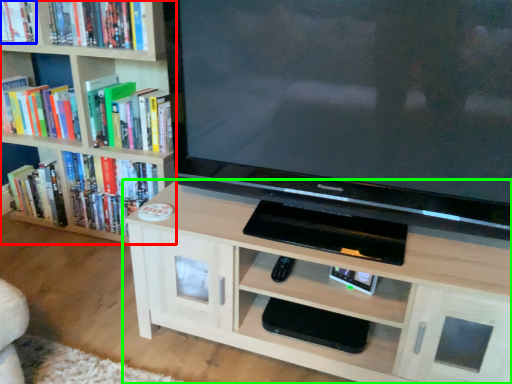
Question: Considering the real-world distances, which object is farthest from bookcase (highlighted by a red box)? book (highlighted by a blue box) or shelf (highlighted by a green box)?

Choices:
 (A) book
 (B) shelf

Answer: (B)